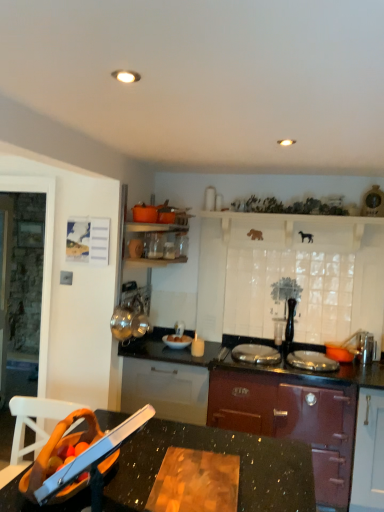
This screenshot has height=512, width=384. What are the coordinates of `matte burgundy stove at center` in the screenshot? It's located at (291, 421).

In order to face black granite countertop at lower center, should I rotate leftwards or rightwards?

A 2.379 degree turn to the left will do.

Locate an element on the screen. This screenshot has width=384, height=512. matte burgundy stove at center is located at coordinates (291, 421).

Which is more to the left, metallic sink at lower center or black granite countertop at lower center?

Positioned to the left is metallic sink at lower center.

Is metallic sink at lower center bigger than black granite countertop at lower center?

Actually, metallic sink at lower center might be smaller than black granite countertop at lower center.

Is the position of metallic sink at lower center less distant than that of black granite countertop at lower center?

Yes, it is in front of black granite countertop at lower center.

Where is `countertop on the right side of metallic sink at lower center`? The image size is (384, 512). countertop on the right side of metallic sink at lower center is located at coordinates (216, 452).

Based on their sizes in the image, would you say white matte cabinet at upper center is bigger or smaller than matte burgundy stove at center?

In the image, white matte cabinet at upper center appears to be smaller than matte burgundy stove at center.

From a real-world perspective, is white matte cabinet at upper center physically located above or below matte burgundy stove at center?

Clearly, from a real-world perspective, white matte cabinet at upper center is above matte burgundy stove at center.

Considering the positions of points (274, 220) and (221, 382), is point (274, 220) farther from camera compared to point (221, 382)?

Yes, it is.

In the image, is white matte cabinet at upper center on the left side or the right side of matte burgundy stove at center?

Clearly, white matte cabinet at upper center is on the right of matte burgundy stove at center in the image.

Is black granite countertop at lower center bigger or smaller than white glossy bowl at center?

In the image, black granite countertop at lower center appears to be larger than white glossy bowl at center.

From a real-world perspective, is black granite countertop at lower center positioned over white glossy bowl at center based on gravity?

Actually, black granite countertop at lower center is physically below white glossy bowl at center in the real world.

Considering the sizes of black granite countertop at lower center and white glossy bowl at center in the image, is black granite countertop at lower center wider or thinner than white glossy bowl at center?

In the image, black granite countertop at lower center appears to be wider than white glossy bowl at center.

Can white glossy bowl at center be found inside black granite countertop at lower center?

No, white glossy bowl at center is not inside black granite countertop at lower center.

From a real-world perspective, is matte burgundy stove at center positioned over white glossy bowl at center based on gravity?

Actually, matte burgundy stove at center is physically below white glossy bowl at center in the real world.

Which point is more forward, (348, 387) or (178, 348)?

The point (348, 387) is closer to the camera.

Considering their positions, is matte burgundy stove at center located in front of or behind white glossy bowl at center?

matte burgundy stove at center is in front of white glossy bowl at center.

Locate an element on the screen. kitchen appliance behind the matte burgundy stove at center is located at coordinates (177, 341).

Can you confirm if matte burgundy stove at center is wider than white matte cabinet at upper center?

Correct, the width of matte burgundy stove at center exceeds that of white matte cabinet at upper center.

Is point (337, 480) closer to camera compared to point (248, 237)?

Yes, point (337, 480) is closer to viewer.

Is matte burgundy stove at center not close to white matte cabinet at upper center?

Yes, matte burgundy stove at center and white matte cabinet at upper center are located far from each other.

From a real-world perspective, between matte burgundy stove at center and white matte cabinet at upper center, who is vertically lower?

matte burgundy stove at center, from a real-world perspective.

Is metallic sink at lower center oriented towards white glossy bowl at center?

No, metallic sink at lower center does not turn towards white glossy bowl at center.

Is there a large distance between metallic sink at lower center and white glossy bowl at center?

Yes.

Considering the points (26, 483) and (166, 337), which point is in front, point (26, 483) or point (166, 337)?

The point (26, 483) is in front.

Identify the location of sink that appears above the white glossy bowl at center (from the image's perspective). (83, 452).

From a real-world perspective, is black granite countertop at lower center on white matte cabinet at upper center?

No, from a real-world perspective, black granite countertop at lower center is not over white matte cabinet at upper center

At what (x,y) coordinates should I click in order to perform the action: click on shelf on the right of black granite countertop at lower center. Please return your answer as a coordinate pair (x, y). This screenshot has height=512, width=384. Looking at the image, I should click on (296, 230).

Which object is more forward, black granite countertop at lower center or white matte cabinet at upper center?

black granite countertop at lower center.

Between black granite countertop at lower center and white matte cabinet at upper center, which one has smaller size?

white matte cabinet at upper center is smaller.

I want to click on countertop that appears below the metallic sink at lower center (from the image's perspective), so click(x=216, y=452).

Locate an element on the screen. The height and width of the screenshot is (512, 384). shelf above the matte burgundy stove at center (from a real-world perspective) is located at coordinates (296, 230).

Looking at the image, which one is located further to black granite countertop at lower center, matte burgundy stove at center or white matte cabinet at upper center?

white matte cabinet at upper center is positioned further to the anchor black granite countertop at lower center.

When comparing their distances from matte burgundy stove at center, does black granite countertop at lower center or metallic sink at lower center seem closer?

black granite countertop at lower center is closer to matte burgundy stove at center.

Estimate the real-world distances between objects in this image. Which object is closer to matte burgundy stove at center, black granite countertop at lower center or white matte cabinet at upper center?

Based on the image, black granite countertop at lower center appears to be nearer to matte burgundy stove at center.

Estimate the real-world distances between objects in this image. Which object is further from matte burgundy stove at center, metallic sink at lower center or black granite countertop at lower center?

Based on the image, metallic sink at lower center appears to be further to matte burgundy stove at center.

When comparing their distances from metallic sink at lower center, does white glossy bowl at center or matte burgundy stove at center seem closer?

matte burgundy stove at center lies closer to metallic sink at lower center than the other object.

Based on their spatial positions, is metallic sink at lower center or white matte cabinet at upper center closer to white glossy bowl at center?

white matte cabinet at upper center is closer to white glossy bowl at center.

Looking at this image, when comparing their distances from white matte cabinet at upper center, does white glossy bowl at center or metallic sink at lower center seem further?

Among the two, metallic sink at lower center is located further to white matte cabinet at upper center.

Considering their positions, is black granite countertop at lower center positioned further to white matte cabinet at upper center than white glossy bowl at center?

black granite countertop at lower center.

I want to click on cabinetry positioned between black granite countertop at lower center and white matte cabinet at upper center from near to far, so click(291, 421).

This screenshot has height=512, width=384. I want to click on cabinetry between metallic sink at lower center and white glossy bowl at center along the z-axis, so click(291, 421).

Locate an element on the screen. countertop between metallic sink at lower center and white matte cabinet at upper center along the z-axis is located at coordinates (216, 452).

This screenshot has height=512, width=384. In order to click on shelf positioned between black granite countertop at lower center and white glossy bowl at center from near to far in this screenshot , I will do `click(296, 230)`.